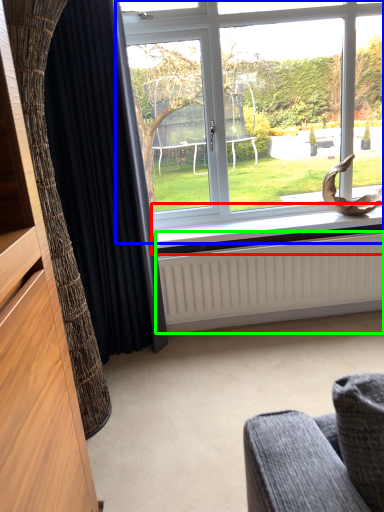
Question: Which object is positioned farthest from window sill (highlighted by a red box)? Select from window (highlighted by a blue box) and radiator (highlighted by a green box).

Choices:
 (A) window
 (B) radiator

Answer: (A)